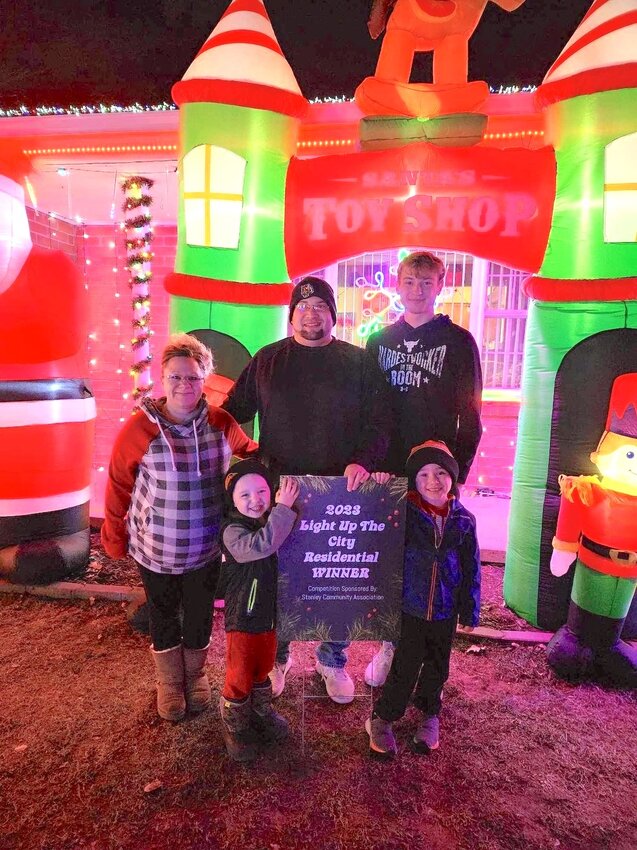
Where is `lighted garland`? lighted garland is located at coordinates (140, 246).